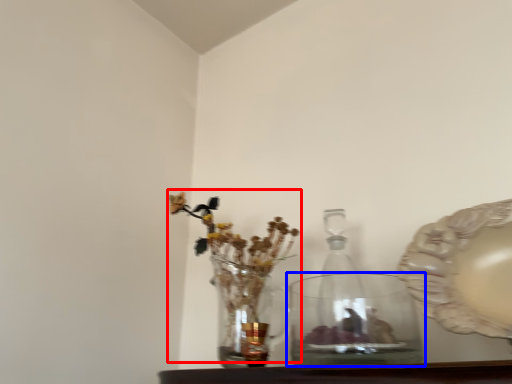
Question: Among these objects, which one is nearest to the camera, floral arrangement (highlighted by a red box) or vase (highlighted by a blue box)?

Choices:
 (A) floral arrangement
 (B) vase

Answer: (B)